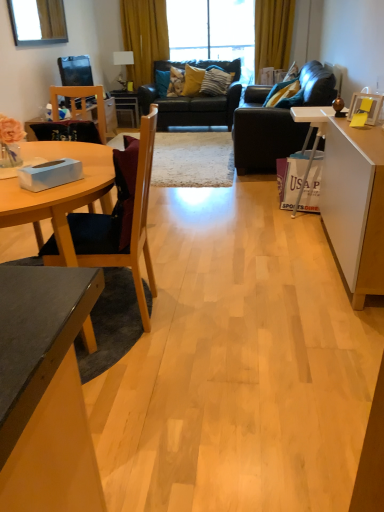
Locate an element on the screen. The height and width of the screenshot is (512, 384). free space that is in between light wood/finished coffee table at lower left and wooden chair at left, arranged as the 2th chair when viewed from the top is located at coordinates (161, 286).